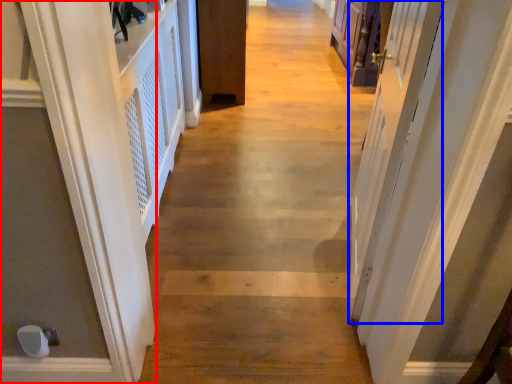
Question: Among these objects, which one is nearest to the camera, door (highlighted by a red box) or screen door (highlighted by a blue box)?

Choices:
 (A) door
 (B) screen door

Answer: (B)